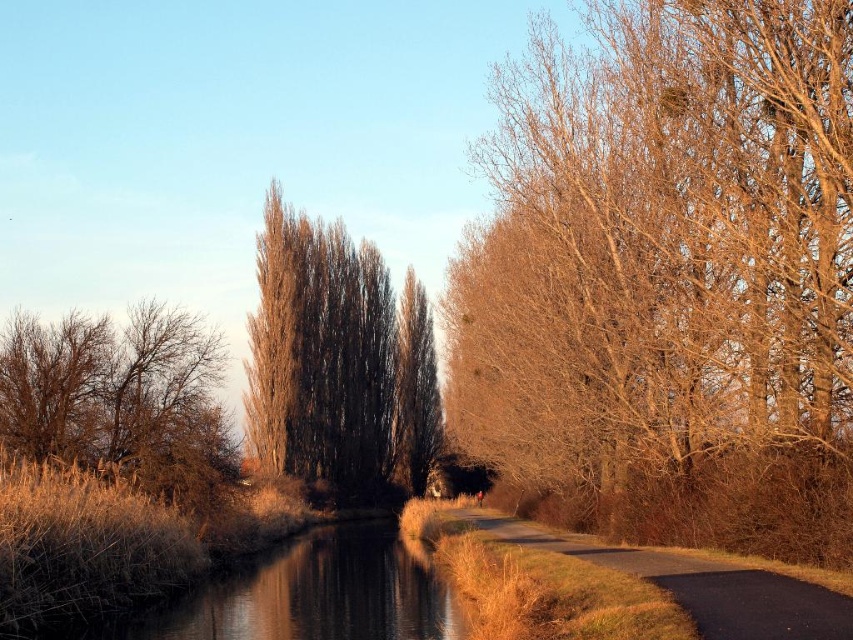
Identify the location of brown textured tree at right. (670, 276).

Is brown textured tree at right above brown textured tree at left?

Indeed, brown textured tree at right is positioned over brown textured tree at left.

Find the location of a particular element. The width and height of the screenshot is (853, 640). brown textured tree at right is located at coordinates (x=670, y=276).

Does point (283, 609) come in front of point (589, 540)?

That is True.

Where is `brown grassy river at center`? The image size is (853, 640). brown grassy river at center is located at coordinates (300, 595).

Is point (277, 595) farther from viewer compared to point (712, 573)?

Yes.

Locate an element on the screen. This screenshot has width=853, height=640. brown grassy river at center is located at coordinates point(300,595).

Can you confirm if brown/dry wood trees at center is taller than dark asphalt road at center?

Yes, brown/dry wood trees at center is taller than dark asphalt road at center.

Identify the location of brown/dry wood trees at center. (337, 364).

Which is in front, point (285, 333) or point (675, 577)?

Point (675, 577)

Locate an element on the screen. The image size is (853, 640). brown/dry wood trees at center is located at coordinates (337, 364).